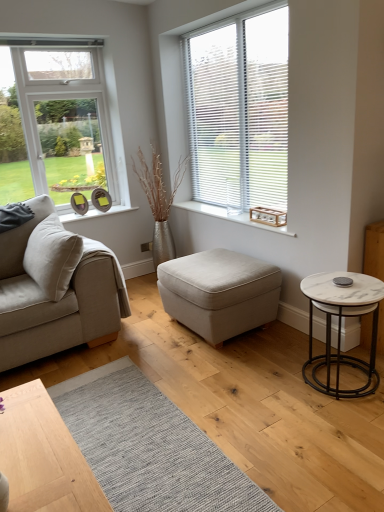
The height and width of the screenshot is (512, 384). Find the location of `vacant space in front of light beige fabric ottoman at center`. vacant space in front of light beige fabric ottoman at center is located at coordinates (216, 373).